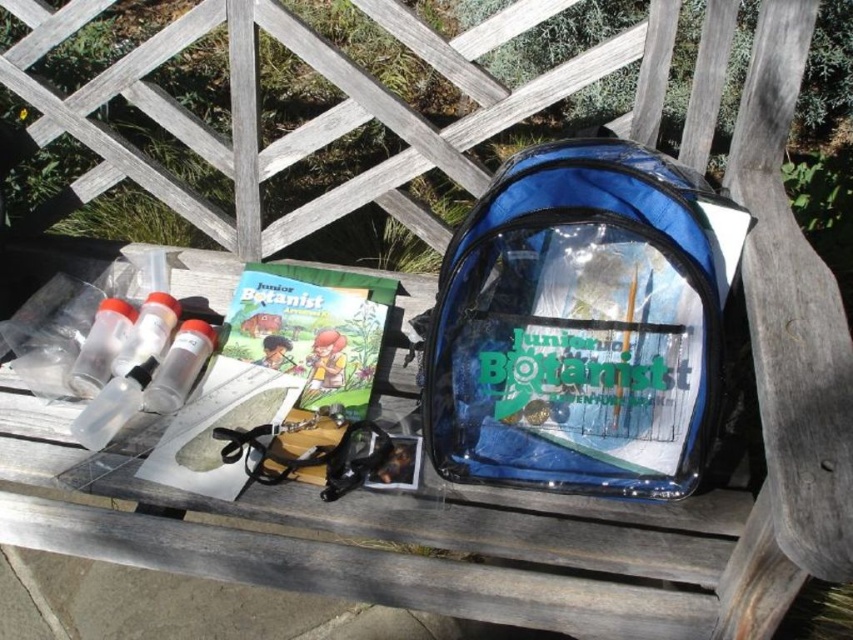
Question: Does transparent blue backpack at center appear under matte green book at center?

Choices:
 (A) yes
 (B) no

Answer: (B)

Question: Can you confirm if transparent blue backpack at center is smaller than matte green book at center?

Choices:
 (A) yes
 (B) no

Answer: (B)

Question: Does transparent blue backpack at center have a lesser width compared to matte green book at center?

Choices:
 (A) yes
 (B) no

Answer: (B)